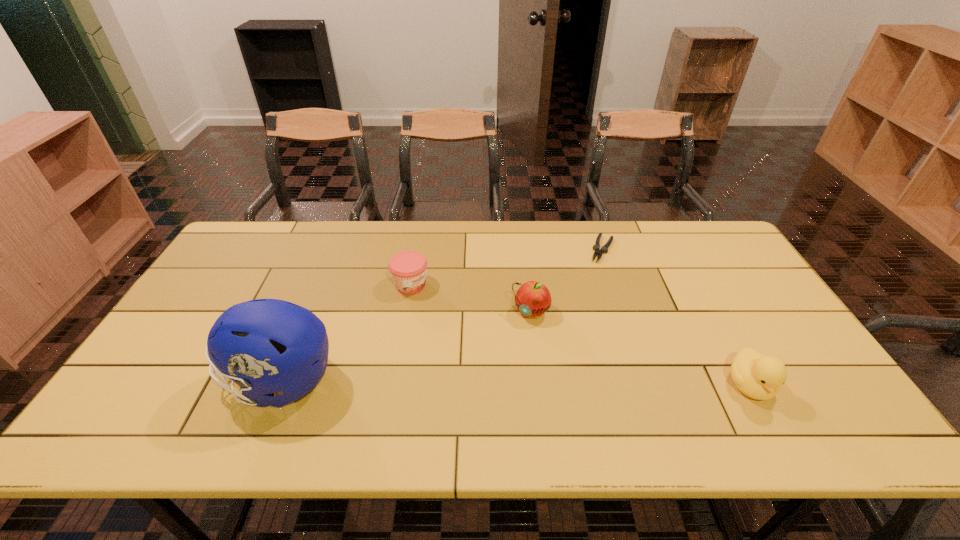
Locate an element on the screen. Image resolution: width=960 pixels, height=540 pixels. free space between the fourth object from right to left and the third farthest object is located at coordinates (470, 299).

The image size is (960, 540). Find the location of `free space between the duck and the fourth tallest object`. free space between the duck and the fourth tallest object is located at coordinates (580, 335).

This screenshot has width=960, height=540. What are the coordinates of `free space that is in between the third farthest object and the leftmost object` in the screenshot? It's located at (405, 346).

The width and height of the screenshot is (960, 540). I want to click on vacant space that is in between the third farthest object and the jam, so click(470, 299).

I want to click on free spot between the rightmost object and the second shortest object, so click(580, 335).

Identify the location of blank region between the fourth tallest object and the rightmost object. This screenshot has width=960, height=540. (580, 335).

At what (x,y) coordinates should I click in order to perform the action: click on empty location between the fourth object from right to left and the football helmet. Please return your answer as a coordinate pair (x, y). Looking at the image, I should click on point(346,333).

The width and height of the screenshot is (960, 540). Find the location of `vacant point located between the leftmost object and the pliers`. vacant point located between the leftmost object and the pliers is located at coordinates (442, 315).

What are the coordinates of `vacant region between the duck and the fourth nearest object` in the screenshot? It's located at (580, 335).

You are a GUI agent. You are given a task and a screenshot of the screen. Output one action in this format:
    pyautogui.click(x=<x>, y=<y>)
    Task: Click on the vacant area that lies between the pliers and the jam
    The height and width of the screenshot is (540, 960).
    Given the screenshot: What is the action you would take?
    pyautogui.click(x=507, y=267)